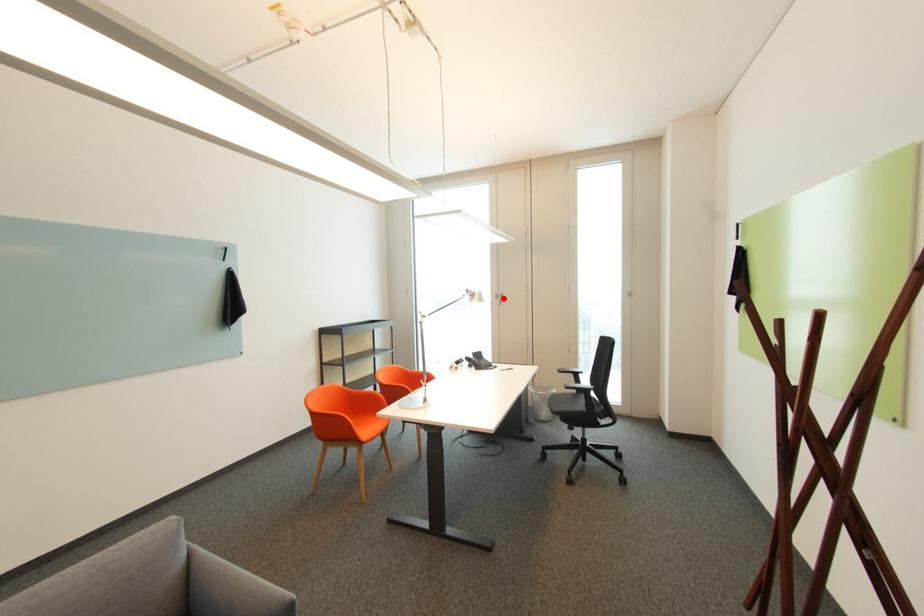
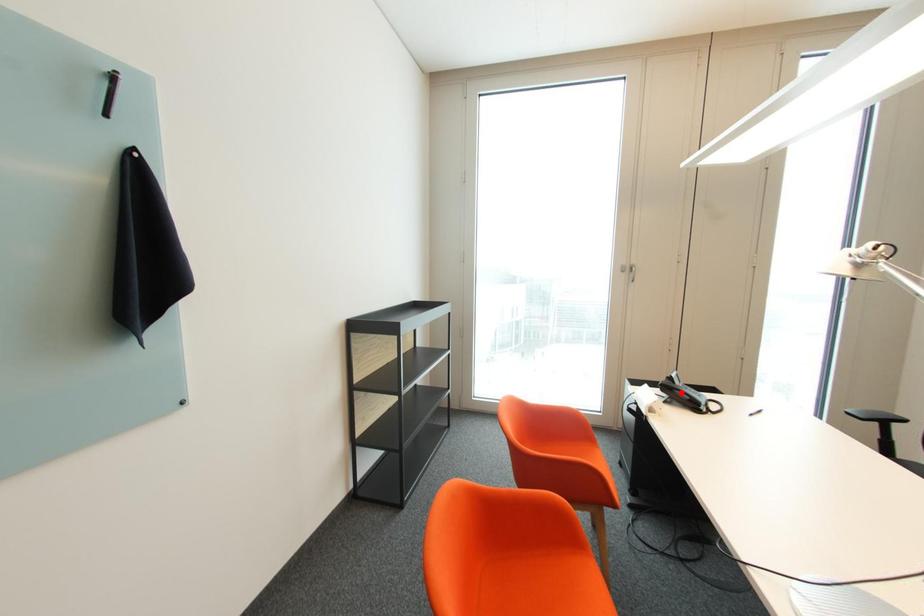
I am providing you with two images of the same scene from different viewpoints. A red point is marked on the first image and another point is marked on the second image. Is the marked point in image1 the same physical position as the marked point in image2?

No